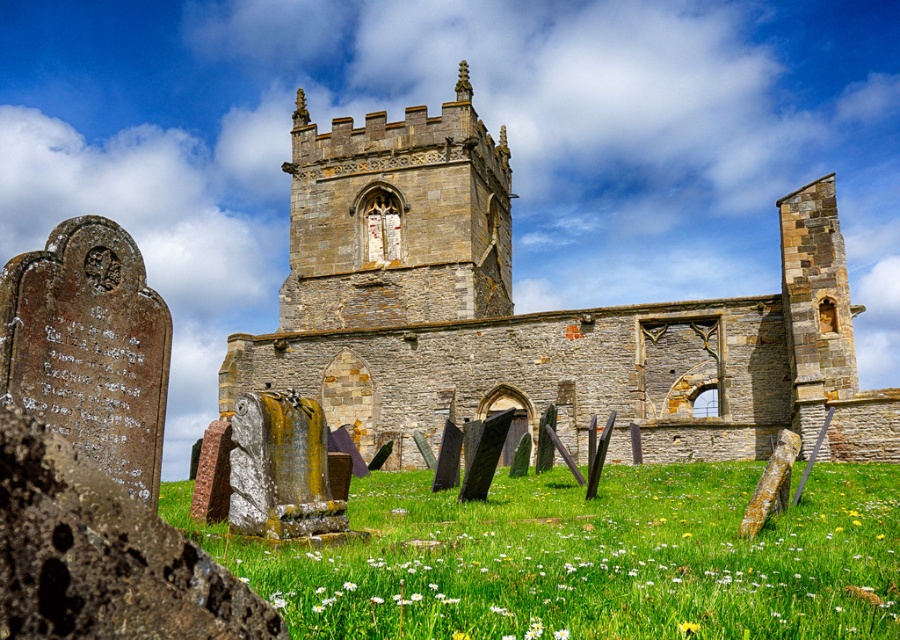
Who is positioned more to the right, gray stone church at center or green grassy field at lower center?

From the viewer's perspective, gray stone church at center appears more on the right side.

Who is lower down, gray stone church at center or green grassy field at lower center?

Positioned lower is green grassy field at lower center.

Which is in front, point (639, 358) or point (879, 529)?

Point (879, 529)

Locate an element on the screen. The width and height of the screenshot is (900, 640). gray stone church at center is located at coordinates (534, 314).